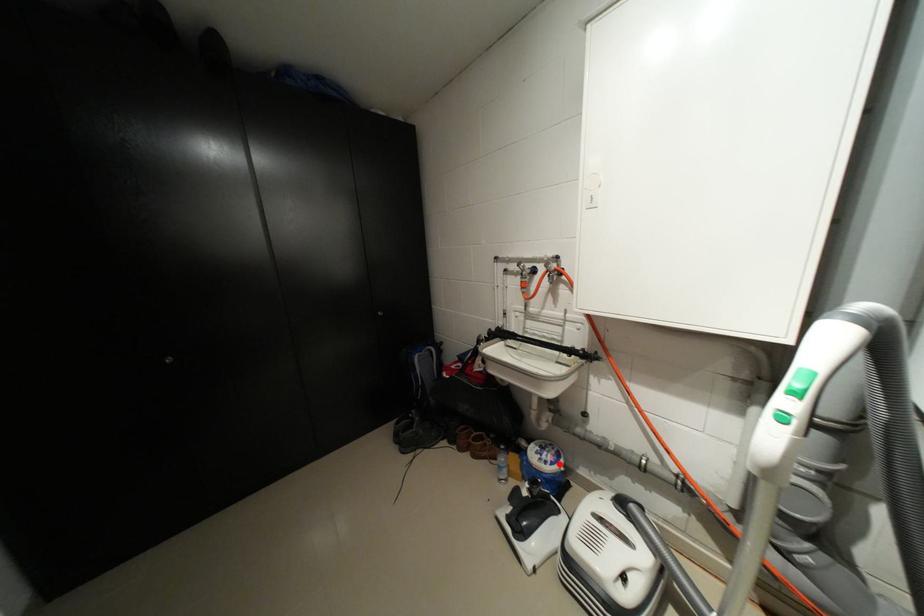
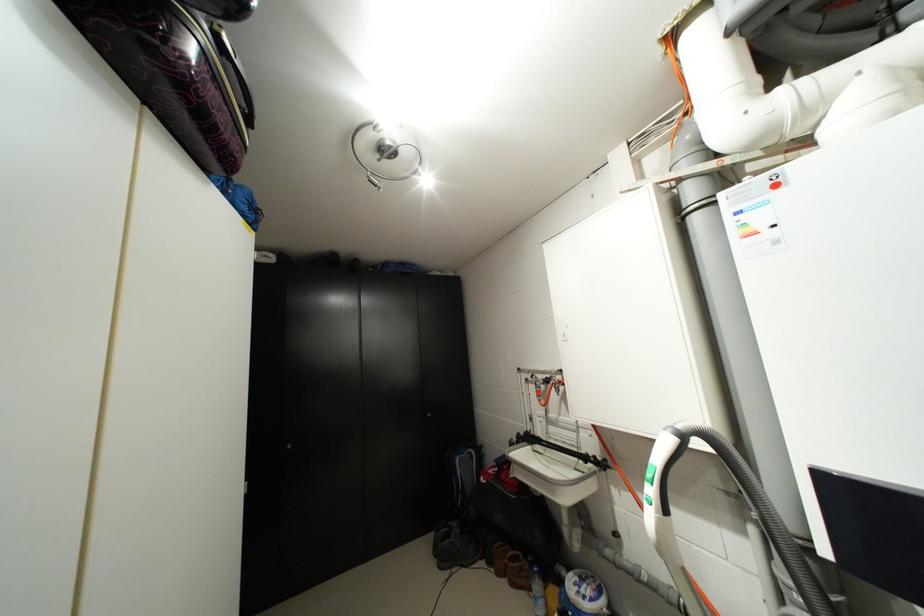
Question: I am providing you with two images of the same scene from different viewpoints. In image1, a red point is highlighted. Considering the same 3D point in image2, which of the following is correct?

Choices:
 (A) It is closer
 (B) It is farther

Answer: (A)